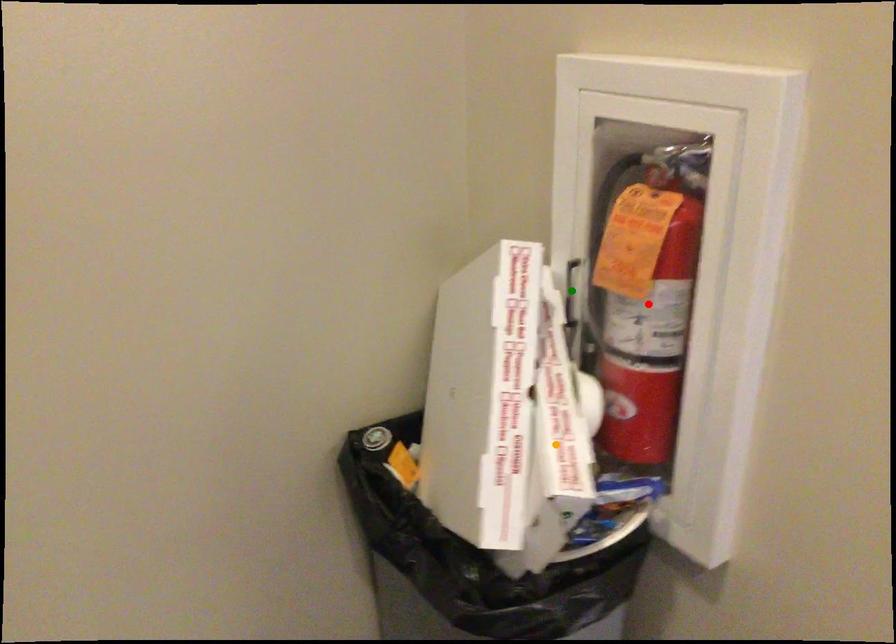
Order these from nearest to farthest:
orange point
red point
green point

green point < red point < orange point